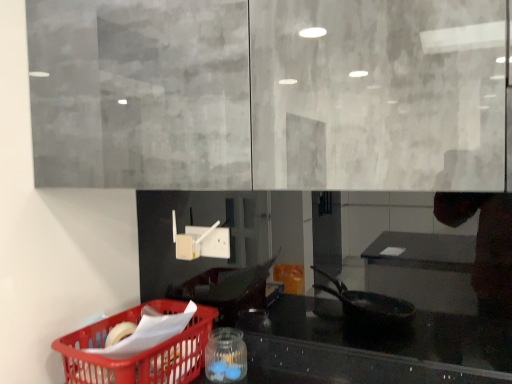
Question: Does transparent glass jar at lower center come behind matte plastic basket at lower left?

Choices:
 (A) no
 (B) yes

Answer: (B)

Question: Considering the relative positions of transparent glass jar at lower center and matte plastic basket at lower left in the image provided, is transparent glass jar at lower center to the right of matte plastic basket at lower left from the viewer's perspective?

Choices:
 (A) yes
 (B) no

Answer: (A)

Question: Considering the relative sizes of transparent glass jar at lower center and matte plastic basket at lower left in the image provided, is transparent glass jar at lower center shorter than matte plastic basket at lower left?

Choices:
 (A) yes
 (B) no

Answer: (A)

Question: Does transparent glass jar at lower center have a lesser width compared to matte plastic basket at lower left?

Choices:
 (A) no
 (B) yes

Answer: (B)

Question: From the image's perspective, is transparent glass jar at lower center beneath matte plastic basket at lower left?

Choices:
 (A) yes
 (B) no

Answer: (B)

Question: From the image's perspective, is transparent glass jar at lower center over matte plastic basket at lower left?

Choices:
 (A) no
 (B) yes

Answer: (B)

Question: Is matte plastic basket at lower left far away from transparent glass jar at lower center?

Choices:
 (A) yes
 (B) no

Answer: (B)

Question: Would you say transparent glass jar at lower center is part of matte plastic basket at lower left's contents?

Choices:
 (A) no
 (B) yes

Answer: (A)

Question: From a real-world perspective, is matte plastic basket at lower left positioned under transparent glass jar at lower center based on gravity?

Choices:
 (A) no
 (B) yes

Answer: (A)

Question: From the image's perspective, would you say matte plastic basket at lower left is shown under transparent glass jar at lower center?

Choices:
 (A) yes
 (B) no

Answer: (A)

Question: From the image's perspective, does matte plastic basket at lower left appear higher than transparent glass jar at lower center?

Choices:
 (A) yes
 (B) no

Answer: (B)

Question: Is matte plastic basket at lower left outside transparent glass jar at lower center?

Choices:
 (A) yes
 (B) no

Answer: (A)

Question: From a real-world perspective, is transparent glass jar at lower center positioned above or below matte plastic basket at lower left?

Choices:
 (A) above
 (B) below

Answer: (B)